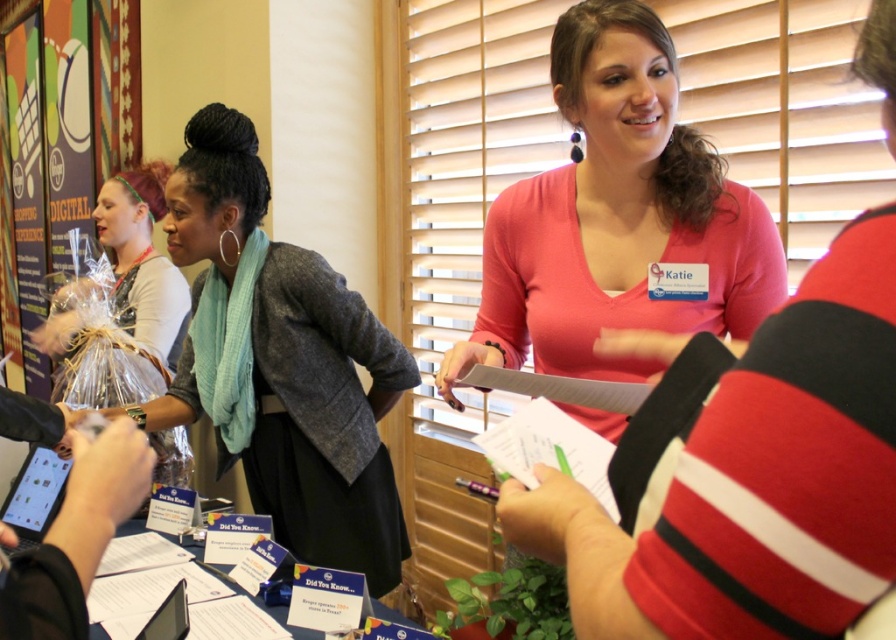
Question: Can you confirm if gray woolen jacket at center is positioned to the left of plastic wrapped bouquet at left?

Choices:
 (A) yes
 (B) no

Answer: (B)

Question: Can you confirm if pink matte shirt at center is bigger than plastic wrapped bouquet at left?

Choices:
 (A) yes
 (B) no

Answer: (B)

Question: Where is gray woolen jacket at center located in relation to plastic wrapped bouquet at left in the image?

Choices:
 (A) below
 (B) above

Answer: (A)

Question: Which object is the farthest from the gray woolen jacket at center?

Choices:
 (A) pink matte shirt at center
 (B) plastic wrapped bouquet at left

Answer: (B)

Question: Which of the following is the closest to the observer?

Choices:
 (A) (657, 68)
 (B) (343, 534)

Answer: (A)

Question: Which of these objects is positioned closest to the pink matte shirt at center?

Choices:
 (A) plastic wrapped bouquet at left
 (B) gray woolen jacket at center

Answer: (B)